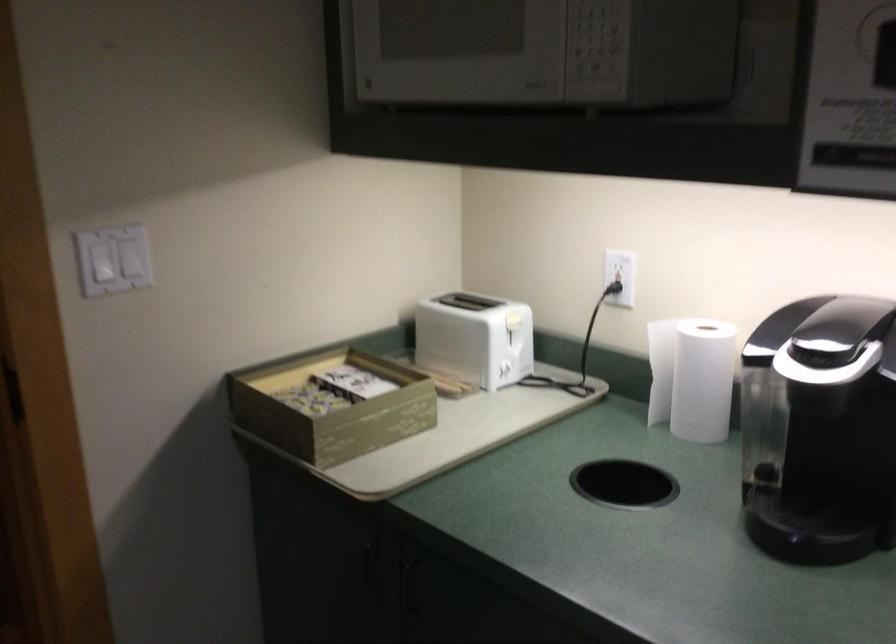
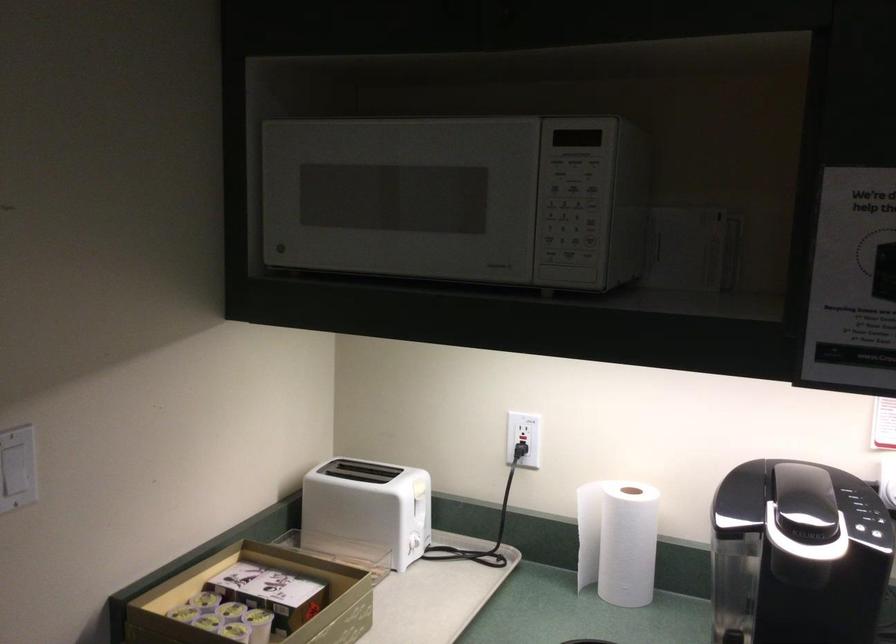
Where in the second image is the point corresponding to pixel 682 375 from the first image?

(617, 540)